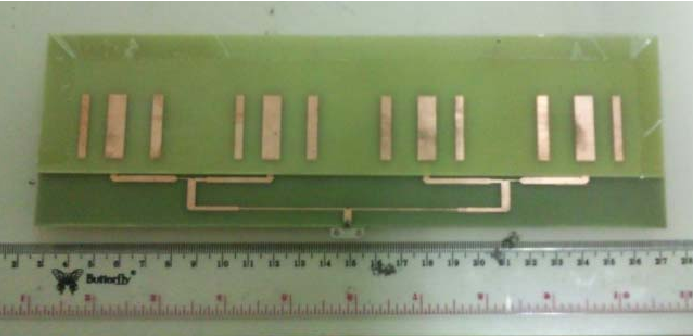
Where is `woooden strips`? This screenshot has height=336, width=694. woooden strips is located at coordinates pos(273,133).